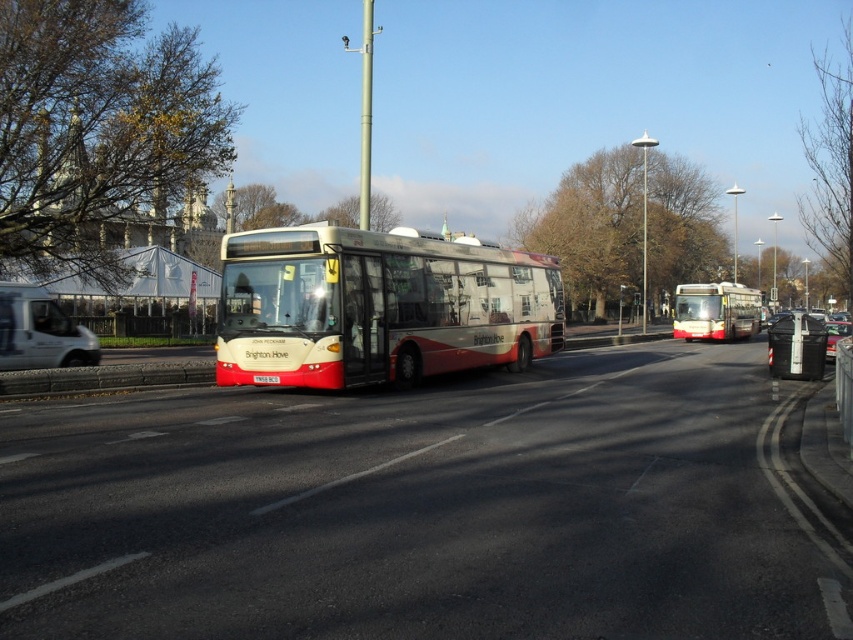
Based on the photo, does black plastic trash can at lower right appear on the right side of metallic silver car at center?

Yes, black plastic trash can at lower right is to the right of metallic silver car at center.

The width and height of the screenshot is (853, 640). What are the coordinates of `black plastic trash can at lower right` in the screenshot? It's located at (796, 346).

The width and height of the screenshot is (853, 640). Identify the location of black plastic trash can at lower right. (796, 346).

Is white glossy bus at center smaller than red matte bus at center?

Indeed, white glossy bus at center has a smaller size compared to red matte bus at center.

Who is higher up, white glossy bus at center or red matte bus at center?

red matte bus at center

Which is behind, point (338, 268) or point (730, 296)?

Point (730, 296)

Where is `white glossy bus at center`? This screenshot has width=853, height=640. white glossy bus at center is located at coordinates (378, 307).

Between point (711, 332) and point (270, 380), which one is positioned in front?

Point (270, 380)

This screenshot has width=853, height=640. What are the coordinates of `red matte bus at center` in the screenshot? It's located at (715, 310).